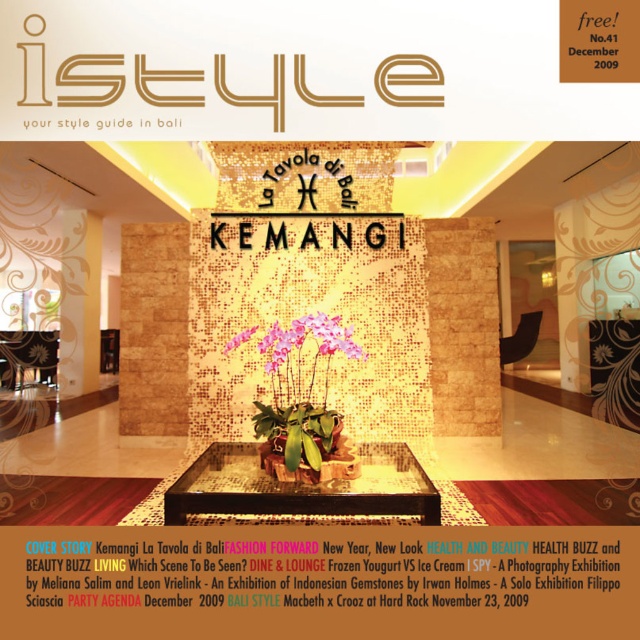
Question: Which of the following is the farthest from the observer?

Choices:
 (A) black mosaic table at center
 (B) pink matte orchid at center

Answer: (B)

Question: Which object appears closest to the camera in this image?

Choices:
 (A) black mosaic table at center
 (B) matte gold mosaic wall at center

Answer: (A)

Question: Does matte gold mosaic wall at center appear on the left side of black mosaic table at center?

Choices:
 (A) yes
 (B) no

Answer: (A)

Question: Estimate the real-world distances between objects in this image. Which object is closer to the black mosaic table at center?

Choices:
 (A) pink matte orchid at center
 (B) matte gold mosaic wall at center

Answer: (A)

Question: Is black mosaic table at center smaller than pink matte orchid at center?

Choices:
 (A) no
 (B) yes

Answer: (A)

Question: Does black mosaic table at center appear under pink matte orchid at center?

Choices:
 (A) no
 (B) yes

Answer: (B)